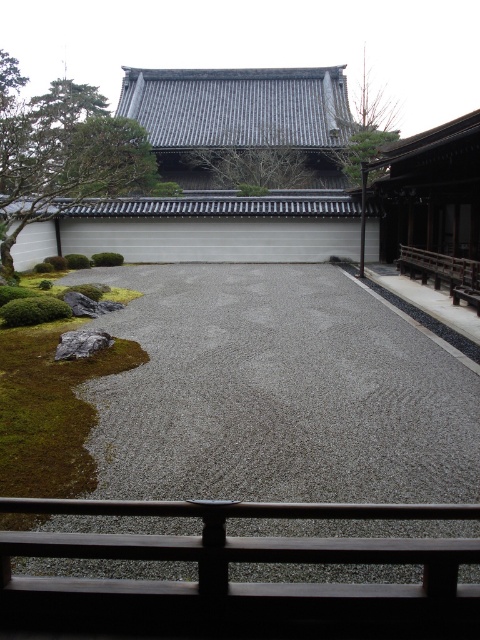
Question: Does green leafy tree at upper left come behind smooth bark tree at upper center?

Choices:
 (A) no
 (B) yes

Answer: (A)

Question: Among these points, which one is nearest to the camera?

Choices:
 (A) (126, 118)
 (B) (98, 339)
 (C) (251, 150)
 (D) (385, 116)

Answer: (B)

Question: Which point is farther from the camera taking this photo?

Choices:
 (A) (376, 157)
 (B) (360, 378)
 (C) (4, 90)

Answer: (C)

Question: Can you confirm if green leafy tree at upper left is wider than gray/smooth rock at lower left?

Choices:
 (A) yes
 (B) no

Answer: (A)

Question: Which object is closer to the camera taking this photo?

Choices:
 (A) green leafy tree at upper left
 (B) green leafy tree at upper center

Answer: (A)

Question: Is gray gravel at center closer to camera compared to gray/smooth rock at lower left?

Choices:
 (A) no
 (B) yes

Answer: (B)